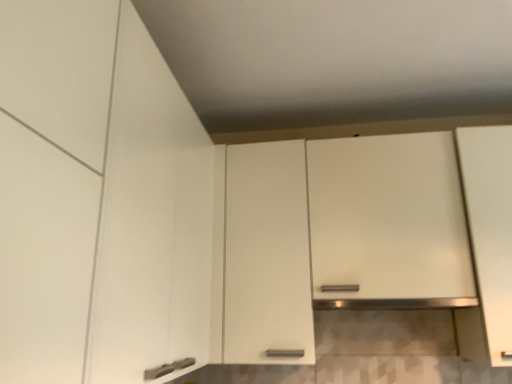
Question: Is white matte cabinet at left, the second cabinetry from the right, inside or outside of white matte cabinet at center, the 2th cabinetry when ordered from left to right?

Choices:
 (A) inside
 (B) outside

Answer: (B)

Question: Considering the positions of point [x=159, y=228] and point [x=399, y=175], is point [x=159, y=228] closer or farther from the camera than point [x=399, y=175]?

Choices:
 (A) farther
 (B) closer

Answer: (B)

Question: In terms of height, does white matte cabinet at left, the second cabinetry from the right, look taller or shorter compared to white matte cabinet at center, acting as the first cabinetry starting from the right?

Choices:
 (A) short
 (B) tall

Answer: (A)

Question: From the image's perspective, is white matte cabinet at center, the 2th cabinetry when ordered from left to right, located above or below white matte cabinet at left, the second cabinetry from the right?

Choices:
 (A) above
 (B) below

Answer: (B)

Question: Based on their sizes in the image, would you say white matte cabinet at center, acting as the first cabinetry starting from the right, is bigger or smaller than white matte cabinet at left, placed as the 1th cabinetry when sorted from left to right?

Choices:
 (A) small
 (B) big

Answer: (B)

Question: Considering the positions of white matte cabinet at center, acting as the first cabinetry starting from the right, and white matte cabinet at left, the second cabinetry from the right, in the image, is white matte cabinet at center, acting as the first cabinetry starting from the right, taller or shorter than white matte cabinet at left, the second cabinetry from the right,?

Choices:
 (A) short
 (B) tall

Answer: (B)

Question: Considering the positions of white matte cabinet at center, acting as the first cabinetry starting from the right, and white matte cabinet at left, placed as the 1th cabinetry when sorted from left to right, in the image, is white matte cabinet at center, acting as the first cabinetry starting from the right, wider or thinner than white matte cabinet at left, placed as the 1th cabinetry when sorted from left to right,?

Choices:
 (A) thin
 (B) wide

Answer: (A)